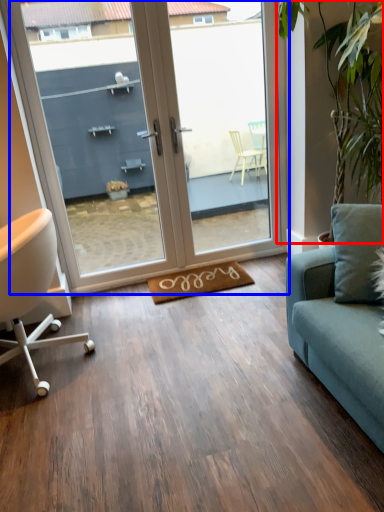
Question: Which of the following is the closest to the observer, plant (highlighted by a red box) or door (highlighted by a blue box)?

Choices:
 (A) plant
 (B) door

Answer: (A)